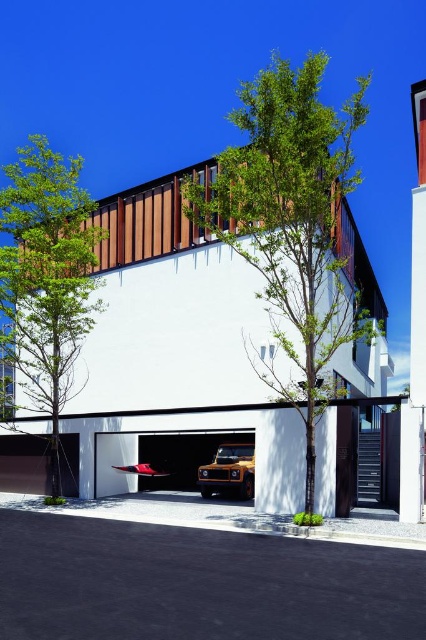
The width and height of the screenshot is (426, 640). Describe the element at coordinates (157, 458) in the screenshot. I see `white glossy garage door at center` at that location.

Does white glossy garage door at center come in front of white matte garage door at lower left?

Yes.

At what (x,y) coordinates should I click in order to perform the action: click on white glossy garage door at center. Please return your answer as a coordinate pair (x, y). The height and width of the screenshot is (640, 426). Looking at the image, I should click on (157, 458).

Image resolution: width=426 pixels, height=640 pixels. I want to click on white glossy garage door at center, so click(157, 458).

Does green leafy tree at center lie in front of green leafy tree at left?

Yes, it is in front of green leafy tree at left.

Between point (282, 132) and point (60, 163), which one is positioned in front?

Point (282, 132) is in front.

This screenshot has height=640, width=426. Identify the location of green leafy tree at center. (291, 228).

Between green leafy tree at center and white glossy garage door at center, which one has less height?

Standing shorter between the two is white glossy garage door at center.

Is green leafy tree at center to the left of white glossy garage door at center from the viewer's perspective?

In fact, green leafy tree at center is to the right of white glossy garage door at center.

Find the location of `green leafy tree at center`. green leafy tree at center is located at coordinates point(291,228).